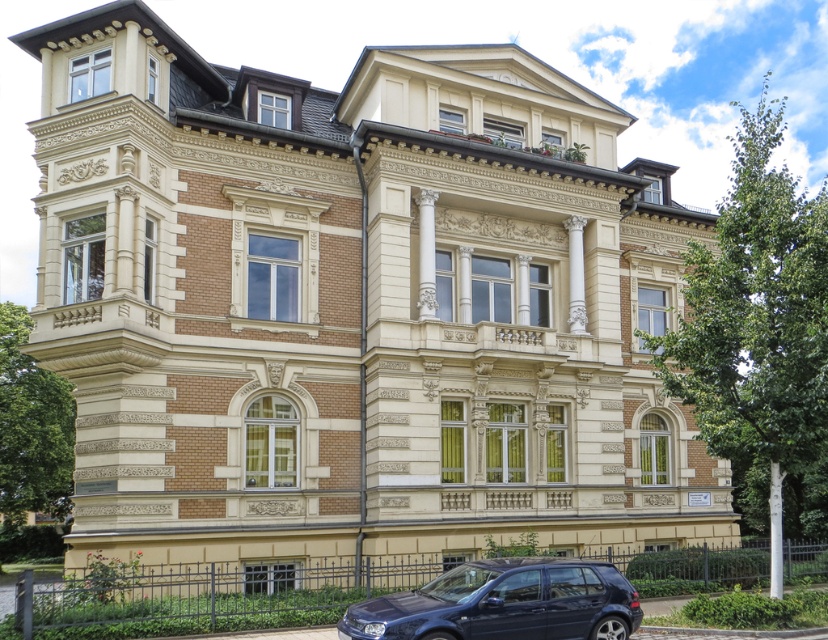
Question: Which point is closer to the camera?

Choices:
 (A) glossy dark blue car at lower center
 (B) green grass at lower center

Answer: (A)

Question: Can you confirm if green grass at lower center is bigger than glossy dark blue car at lower center?

Choices:
 (A) no
 (B) yes

Answer: (B)

Question: Is green grass at lower center thinner than glossy dark blue car at lower center?

Choices:
 (A) no
 (B) yes

Answer: (A)

Question: Which point is closer to the camera?

Choices:
 (A) green grass at lower center
 (B) glossy dark blue car at lower center

Answer: (B)

Question: Observing the image, what is the correct spatial positioning of green grass at lower center in reference to glossy dark blue car at lower center?

Choices:
 (A) below
 (B) above

Answer: (A)

Question: Which object appears closest to the camera in this image?

Choices:
 (A) glossy dark blue car at lower center
 (B) green grass at lower center

Answer: (A)